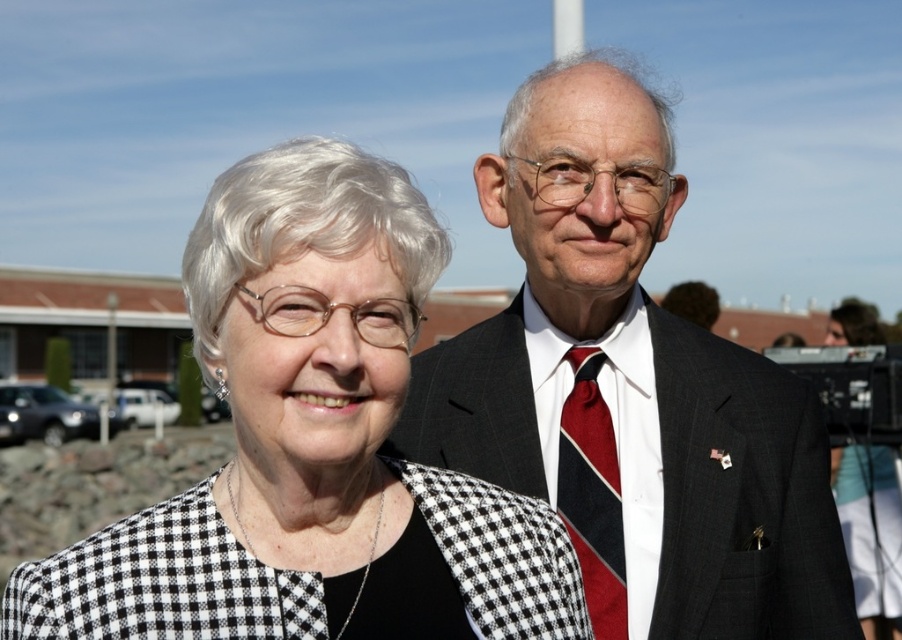
You are a photographer setting up for a group photo. You need to ensure that the black checkered blazer at center and the red striped tie at center are both visible in the frame. Based on their positions, which clothing item is closer to the camera?

The black checkered blazer at center is taller than the red striped tie at center, so the blazer is closer to the camera because objects closer to the camera appear larger in the frame.

You are a photographer setting up for a group photo. You need to position the black checkered blazer at center and the dark gray suit at center so that both fit comfortably within the frame. Which clothing item requires more horizontal space due to its width?

The dark gray suit at center requires more horizontal space because it has a greater width compared to the black checkered blazer at center.

You are a photographer setting up for an outdoor event. You need to position a backdrop that will cover the area between the black checkered blazer at center and the dark gray suit at center. Based on their positions, will the backdrop need to be taller than 1.5 meters?

The black checkered blazer at center is located below the dark gray suit at center, so the backdrop needs to be taller than 1.5 meters to cover the vertical distance between them.